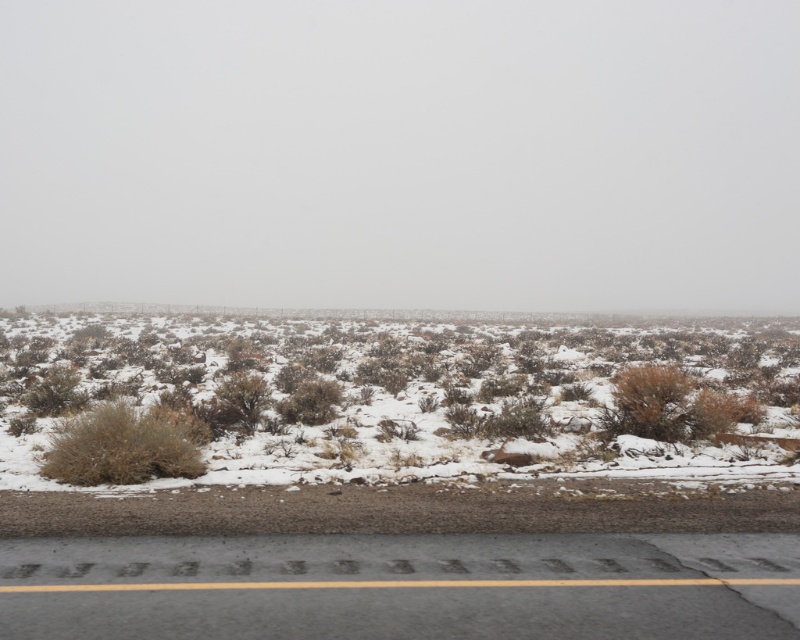
Question: Where is fuzzy brown shrubs at lower center located in relation to dry shrub at center-left in the image?

Choices:
 (A) above
 (B) below

Answer: (A)

Question: Which point is closer to the camera?

Choices:
 (A) dry shrub at center-left
 (B) fuzzy brown shrubs at lower center

Answer: (A)

Question: Is fuzzy brown shrubs at lower center in front of dry shrub at center-left?

Choices:
 (A) no
 (B) yes

Answer: (A)

Question: Can you confirm if fuzzy brown shrubs at lower center is wider than dry shrub at center-left?

Choices:
 (A) no
 (B) yes

Answer: (B)